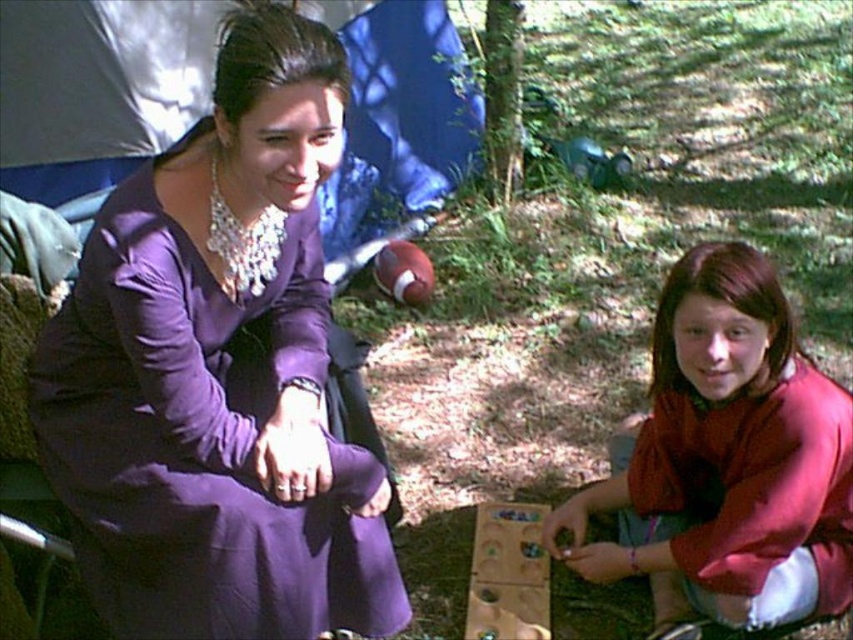
Question: Among these objects, which one is nearest to the camera?

Choices:
 (A) matte red sweater at lower right
 (B) purple satin dress at center

Answer: (B)

Question: Can you confirm if purple satin dress at center is thinner than matte red sweater at lower right?

Choices:
 (A) yes
 (B) no

Answer: (B)

Question: Which point appears farthest from the camera in this image?

Choices:
 (A) (165, 310)
 (B) (668, 568)

Answer: (B)

Question: Is purple satin dress at center positioned behind matte red sweater at lower right?

Choices:
 (A) no
 (B) yes

Answer: (A)

Question: Does purple satin dress at center appear over matte red sweater at lower right?

Choices:
 (A) no
 (B) yes

Answer: (B)